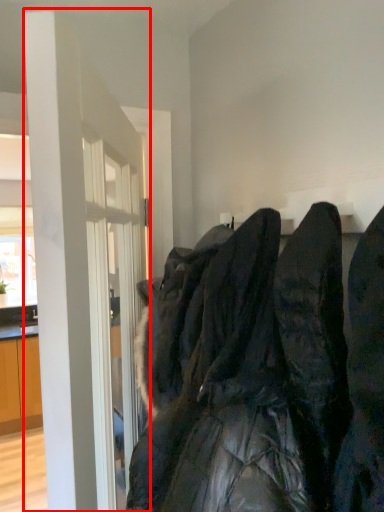
Question: From the image's perspective, considering the relative positions of door (annotated by the red box) and laundry in the image provided, where is door (annotated by the red box) located with respect to the staircase?

Choices:
 (A) below
 (B) above

Answer: (A)